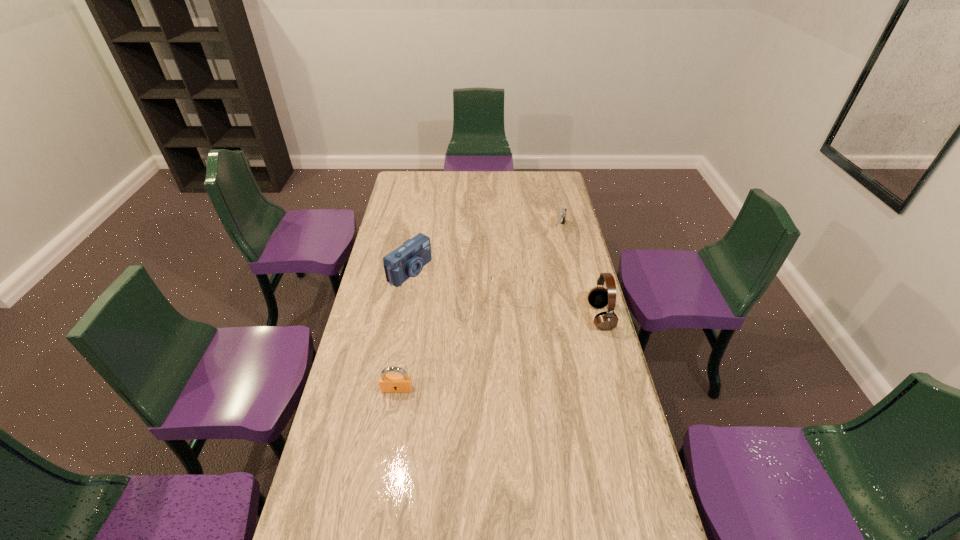
Find the location of a particular element. Image resolution: width=960 pixels, height=540 pixels. vacant space located 0.320m on the front-facing side of the shortest object is located at coordinates (507, 377).

Image resolution: width=960 pixels, height=540 pixels. What are the coordinates of `free point located 0.270m on the front-facing side of the shortest object` in the screenshot? It's located at (507, 365).

Identify the location of free space located 0.070m on the front-facing side of the shortest object. The height and width of the screenshot is (540, 960). (510, 321).

The height and width of the screenshot is (540, 960). I want to click on vacant point located on the lens of the camera, so click(x=479, y=312).

The image size is (960, 540). I want to click on blank space located 0.280m on the lens of the camera, so click(479, 312).

This screenshot has width=960, height=540. Find the location of `free region located on the lens of the camera`. free region located on the lens of the camera is located at coordinates (468, 306).

Find the location of `vacant region located at the muzzle of the gun`. vacant region located at the muzzle of the gun is located at coordinates (542, 291).

Identify the location of free space located at the muzzle of the gun. The image size is (960, 540). (554, 256).

At what (x,y) coordinates should I click in order to perform the action: click on free space located at the muzzle of the gun. Please return your answer as a coordinate pair (x, y). This screenshot has height=540, width=960. Looking at the image, I should click on (541, 293).

Where is `padlock at the left edge`? The height and width of the screenshot is (540, 960). padlock at the left edge is located at coordinates (389, 383).